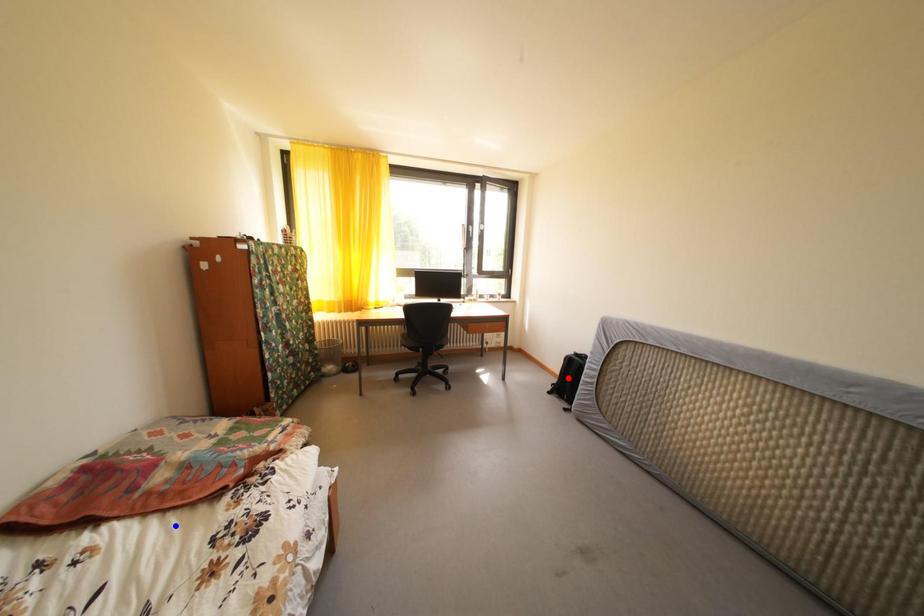
Question: Two points are marked on the image. Which point is closer to the camera?

Choices:
 (A) Blue point is closer.
 (B) Red point is closer.

Answer: (A)